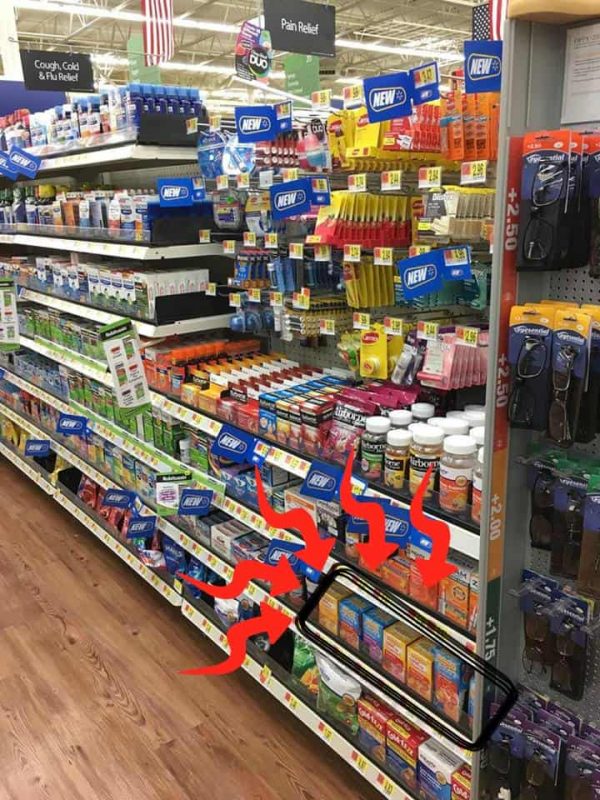
You are a GUI agent. You are given a task and a screenshot of the screen. Output one action in this format:
    pyautogui.click(x=<x>, y=<y>)
    Task: Click on the lights
    The image size is (600, 800).
    Given the screenshot: What is the action you would take?
    pyautogui.click(x=226, y=28), pyautogui.click(x=196, y=66)